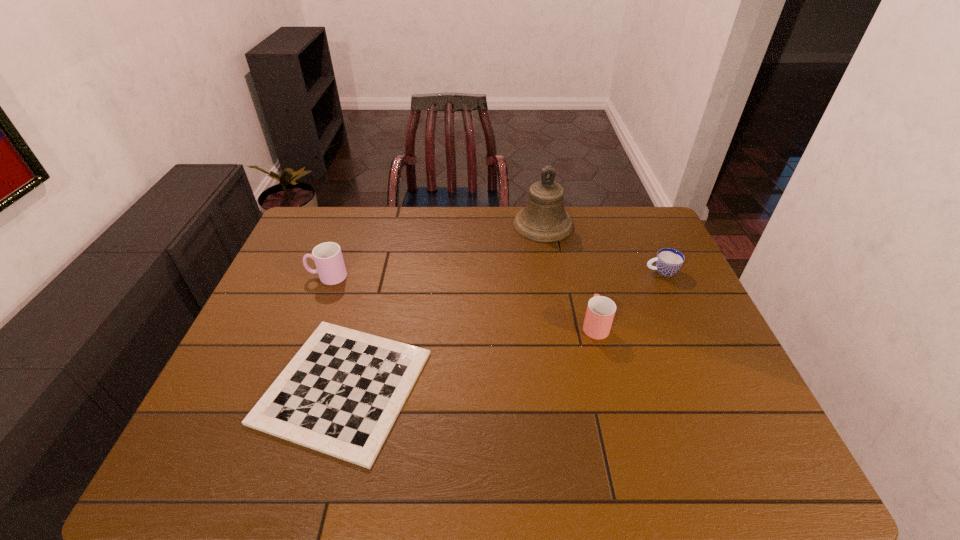
This screenshot has height=540, width=960. I want to click on object that is positioned at the right edge, so click(x=668, y=261).

Locate an element on the screen. This screenshot has height=540, width=960. object located at the near left corner is located at coordinates (341, 393).

You are a GUI agent. You are given a task and a screenshot of the screen. Output one action in this format:
    pyautogui.click(x=<x>, y=<y>)
    Task: Click on the free space at the far edge of the desktop
    
    Given the screenshot: What is the action you would take?
    pyautogui.click(x=577, y=239)

In order to click on free space at the near edge of the desktop in this screenshot , I will do `click(626, 480)`.

Locate an element on the screen. vacant space at the left edge of the desktop is located at coordinates (264, 319).

What are the coordinates of `vacant space at the right edge` in the screenshot? It's located at (694, 299).

The width and height of the screenshot is (960, 540). I want to click on blank space at the far left corner, so click(x=328, y=214).

Image resolution: width=960 pixels, height=540 pixels. In the image, there is a desktop. In order to click on free space at the far right corner in this screenshot , I will do `click(625, 233)`.

In the image, there is a desktop. Identify the location of vacant space at the near right corner. (728, 443).

The height and width of the screenshot is (540, 960). I want to click on vacant space that is in between the bell and the shortest object, so click(444, 306).